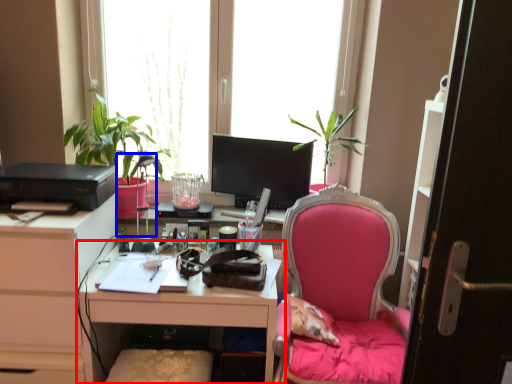
Question: Which object is further to the camera taking this photo, desk (highlighted by a red box) or lamp (highlighted by a blue box)?

Choices:
 (A) desk
 (B) lamp

Answer: (B)